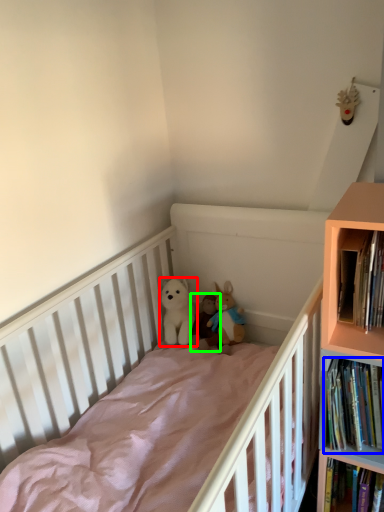
Question: Which is nearer to the toy (highlighted by a red box)? book (highlighted by a blue box) or toy (highlighted by a green box).

Choices:
 (A) book
 (B) toy

Answer: (B)